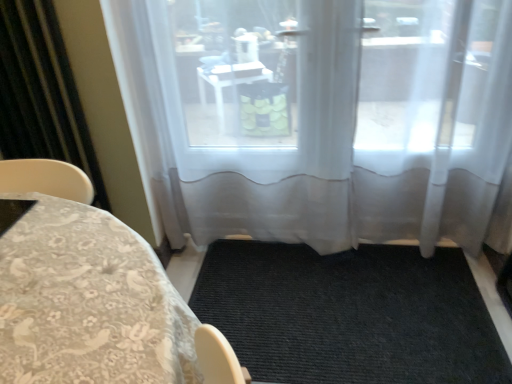
Question: Considering the relative positions of patterned fabric tablecloth at lower left and transparent fabric at center in the image provided, is patterned fabric tablecloth at lower left behind transparent fabric at center?

Choices:
 (A) no
 (B) yes

Answer: (A)

Question: Is patterned fabric tablecloth at lower left positioned with its back to transparent fabric at center?

Choices:
 (A) no
 (B) yes

Answer: (A)

Question: Is patterned fabric tablecloth at lower left in contact with transparent fabric at center?

Choices:
 (A) no
 (B) yes

Answer: (A)

Question: Does patterned fabric tablecloth at lower left have a lesser width compared to transparent fabric at center?

Choices:
 (A) yes
 (B) no

Answer: (B)

Question: From the image's perspective, is patterned fabric tablecloth at lower left below transparent fabric at center?

Choices:
 (A) no
 (B) yes

Answer: (B)

Question: Visually, is transparent fabric at center positioned to the left or to the right of black textured mat at center?

Choices:
 (A) left
 (B) right

Answer: (A)

Question: Considering the positions of transparent fabric at center and black textured mat at center in the image, is transparent fabric at center wider or thinner than black textured mat at center?

Choices:
 (A) wide
 (B) thin

Answer: (B)

Question: From a real-world perspective, is transparent fabric at center above or below black textured mat at center?

Choices:
 (A) above
 (B) below

Answer: (A)

Question: Is point (181, 84) positioned closer to the camera than point (392, 288)?

Choices:
 (A) closer
 (B) farther

Answer: (A)

Question: Based on their positions, is transparent fabric at center located to the left or right of black sheer curtain at left?

Choices:
 (A) right
 (B) left

Answer: (A)

Question: Looking at their shapes, would you say transparent fabric at center is wider or thinner than black sheer curtain at left?

Choices:
 (A) wide
 (B) thin

Answer: (A)

Question: Considering the positions of point (436, 69) and point (25, 8), is point (436, 69) closer or farther from the camera than point (25, 8)?

Choices:
 (A) closer
 (B) farther

Answer: (B)

Question: In the image, is transparent fabric at center positioned in front of or behind black sheer curtain at left?

Choices:
 (A) behind
 (B) front

Answer: (B)

Question: Is black textured mat at center in front of or behind black sheer curtain at left in the image?

Choices:
 (A) front
 (B) behind

Answer: (A)

Question: From the image's perspective, is black textured mat at center located above or below black sheer curtain at left?

Choices:
 (A) above
 (B) below

Answer: (B)